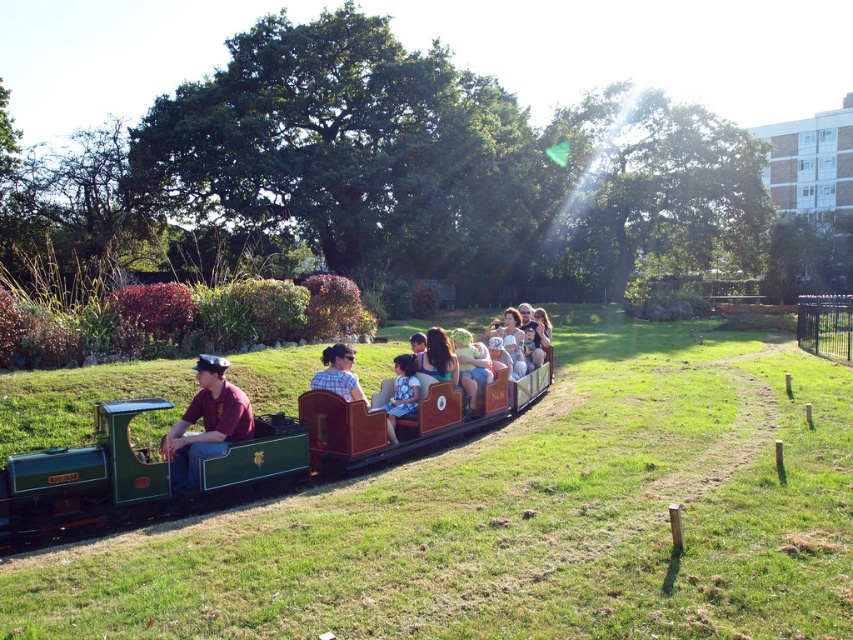
Question: Does plaid shirt at center lie behind blue floral dress at center?

Choices:
 (A) yes
 (B) no

Answer: (B)

Question: From the image, what is the correct spatial relationship of matte blue dress at center in relation to plaid shirt at center?

Choices:
 (A) right
 (B) left

Answer: (A)

Question: Among these objects, which one is farthest from the camera?

Choices:
 (A) matte maroon shirt at center
 (B) blue floral dress at center
 (C) plaid shirt at center

Answer: (B)

Question: Which of the following is the farthest from the observer?

Choices:
 (A) (335, 364)
 (B) (234, 428)

Answer: (A)

Question: Which point is closer to the camera?

Choices:
 (A) matte blue dress at center
 (B) green polished wood train at center

Answer: (B)

Question: Can you confirm if matte maroon shirt at center is thinner than blue floral dress at center?

Choices:
 (A) yes
 (B) no

Answer: (B)